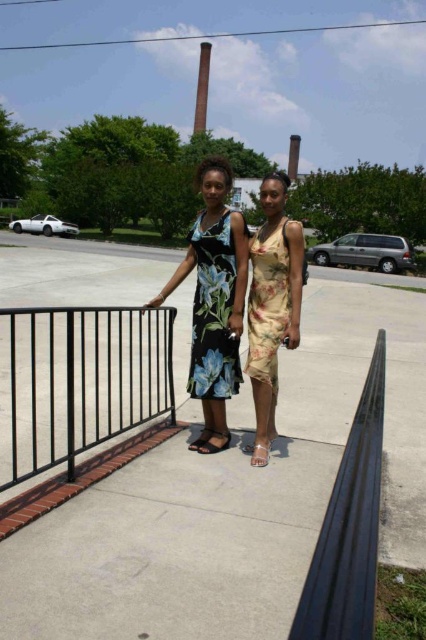
Does floral dress at center have a greater width compared to yellow floral dress at center?

No, floral dress at center is not wider than yellow floral dress at center.

Who is lower down, floral dress at center or yellow floral dress at center?

floral dress at center

Describe the element at coordinates (215, 292) in the screenshot. The width and height of the screenshot is (426, 640). I see `floral dress at center` at that location.

Where is `floral dress at center`? The width and height of the screenshot is (426, 640). floral dress at center is located at coordinates (215, 292).

The height and width of the screenshot is (640, 426). Describe the element at coordinates (77, 381) in the screenshot. I see `black metal railing at left` at that location.

Does point (11, 420) come farther from viewer compared to point (261, 320)?

No, (11, 420) is in front of (261, 320).

Locate an element on the screen. The image size is (426, 640). black metal railing at left is located at coordinates (77, 381).

Which is in front, point (256, 440) or point (192, 442)?

Point (256, 440) is more forward.

Is matte beige sandal at lower center thinner than black leather sandal at center?

Yes.

This screenshot has height=640, width=426. What are the coordinates of `matte beige sandal at lower center` in the screenshot? It's located at (259, 452).